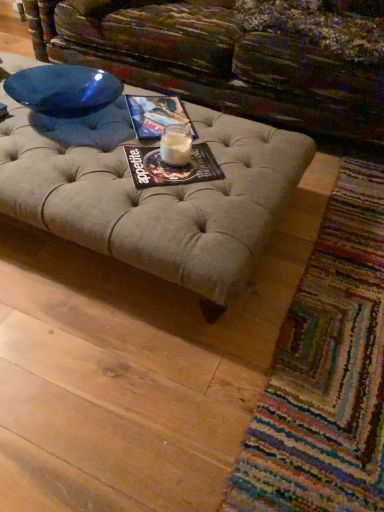
Identify the location of free space to the left of white glass candle at center. (146, 156).